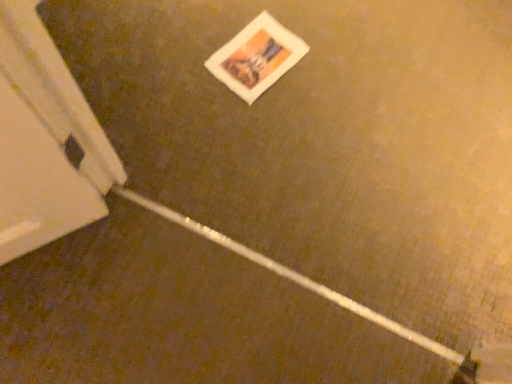
The width and height of the screenshot is (512, 384). In order to click on free space above white glossy pole at lower center (from a real-world perspective) in this screenshot , I will do `click(163, 316)`.